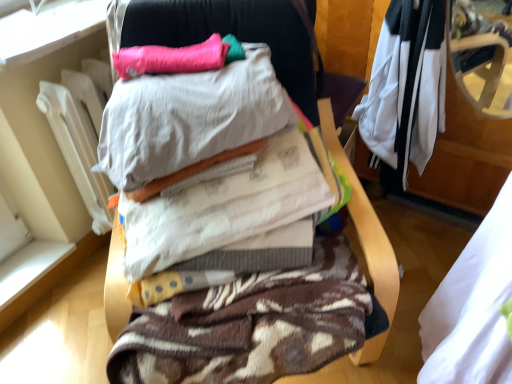
Locate an element on the screen. The width and height of the screenshot is (512, 384). free space above brown knitted blanket at center, which appears as the second clothing when viewed from the back (from a real-world perspective) is located at coordinates (230, 278).